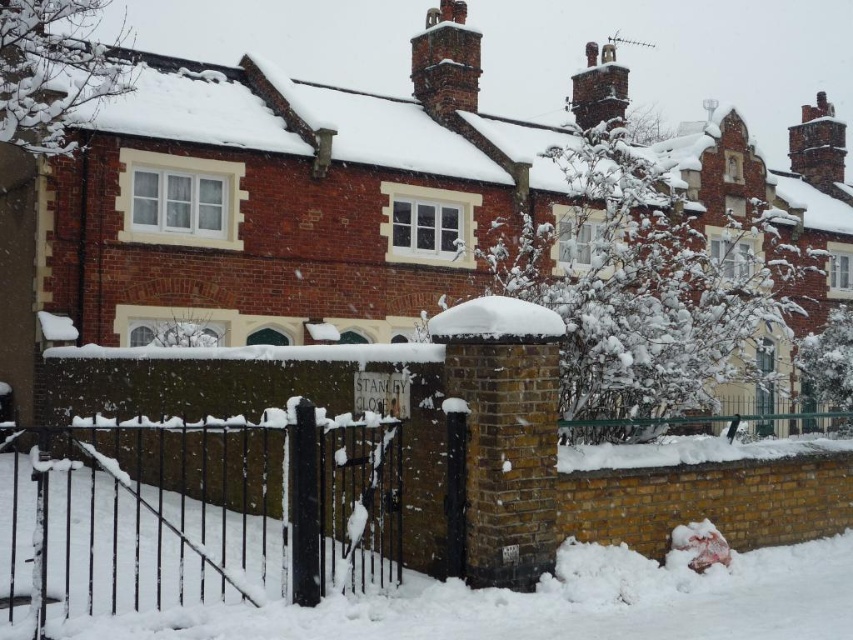
You are a delivery person trying to drive a small van through the black wrought iron gate at lower center. The van is as wide as the white fluffy snow at lower left. Will the van fit through the gate?

The black wrought iron gate at lower center is wider than the white fluffy snow at lower left. Since the van is as wide as the white fluffy snow at lower left, the van will fit through the gate.

You are a delivery person approaching the entrance of the residential area shown in the image. You need to locate the black wrought iron gate at lower center. Based on the scene, where should you look relative to the white fluffy snow at center?

The black wrought iron gate at lower center is located below the white fluffy snow at center, so you should look downward from the white fluffy snow at center to find it.